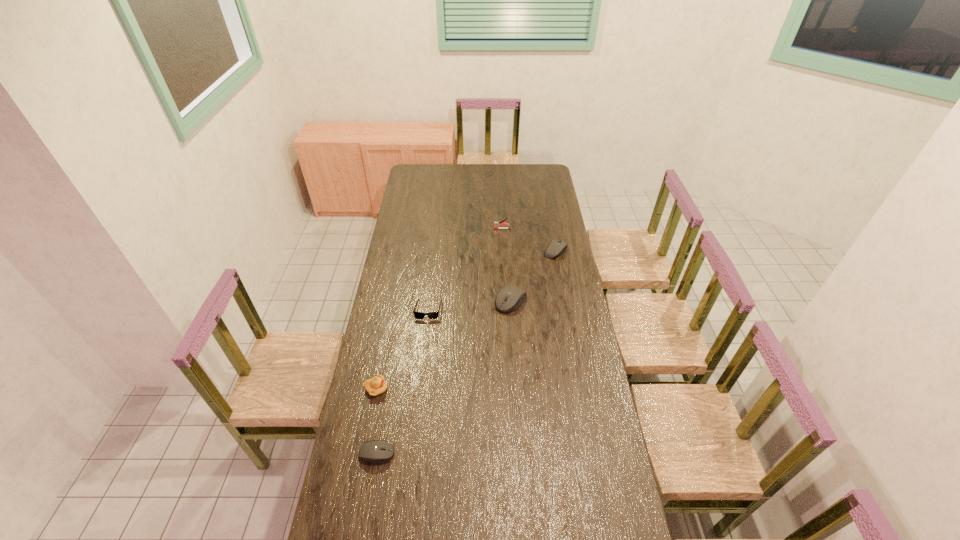
Locate an element on the screen. the nearest object is located at coordinates (376, 451).

Locate an element on the screen. The height and width of the screenshot is (540, 960). the shortest computer equipment is located at coordinates (376, 451).

You are a GUI agent. You are given a task and a screenshot of the screen. Output one action in this format:
    pyautogui.click(x=<x>, y=<y>)
    Task: Click on the second computer equipment from right to left
    
    Given the screenshot: What is the action you would take?
    pyautogui.click(x=510, y=297)

Image resolution: width=960 pixels, height=540 pixels. Find the location of `the second shortest computer equipment`. the second shortest computer equipment is located at coordinates (556, 248).

This screenshot has width=960, height=540. I want to click on the rightmost computer equipment, so click(x=556, y=248).

Locate an element on the screen. The image size is (960, 540). sunglasses is located at coordinates (419, 315).

You are a GUI agent. You are given a task and a screenshot of the screen. Output one action in this format:
    pyautogui.click(x=<x>, y=<y>)
    Task: Click on the stapler
    
    Given the screenshot: What is the action you would take?
    pyautogui.click(x=496, y=224)

Locate an element on the screen. The height and width of the screenshot is (540, 960). the second nearest object is located at coordinates (377, 385).

Image resolution: width=960 pixels, height=540 pixels. Find the location of `free region located on the back of the nearest object`. free region located on the back of the nearest object is located at coordinates [387, 394].

Find the location of `free spot located on the right of the second computer equipment from left to right`. free spot located on the right of the second computer equipment from left to right is located at coordinates (577, 301).